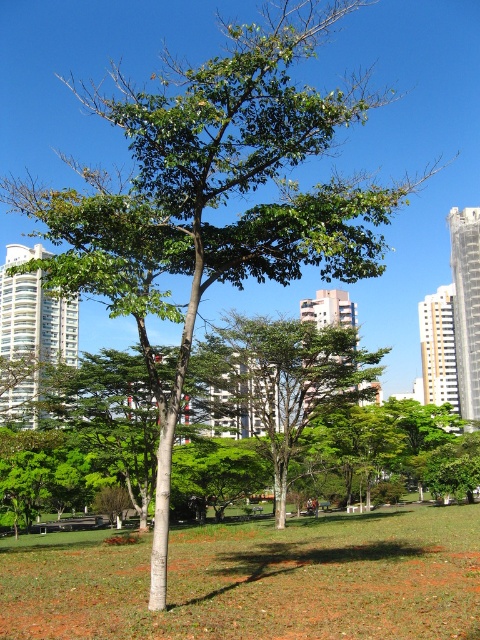
Can you confirm if green grass at center is thinner than green leafy tree at center?

Incorrect, green grass at center's width is not less than green leafy tree at center's.

Which is below, green grass at center or green leafy tree at center?

green grass at center

Between point (134, 572) and point (266, 353), which one is positioned in front?

Point (134, 572) is in front.

The image size is (480, 640). I want to click on green grass at center, so click(x=256, y=579).